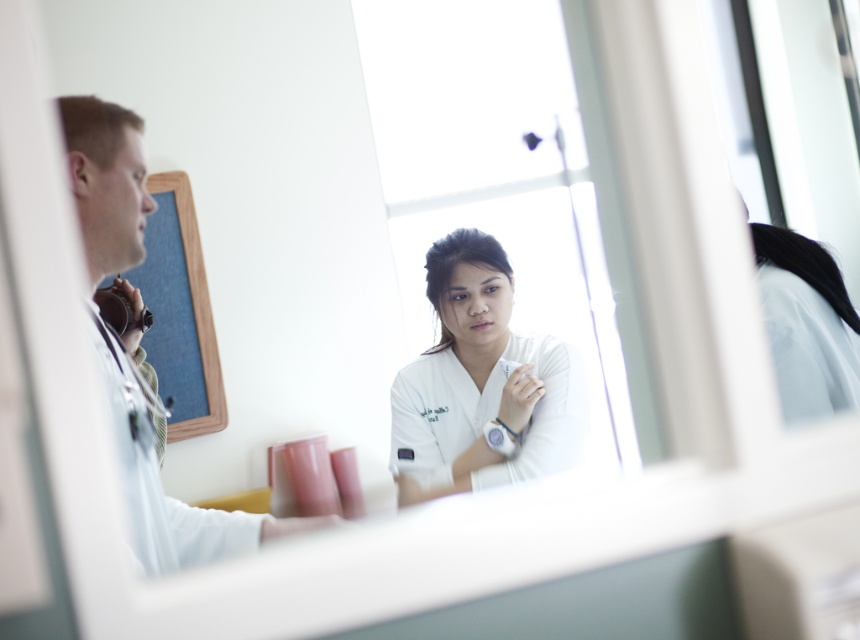
Does white smooth uniform at center have a greater height compared to white smooth stethoscope at left?

Incorrect, white smooth uniform at center's height is not larger of white smooth stethoscope at left's.

Which of these two, white smooth uniform at center or white smooth stethoscope at left, stands shorter?

Standing shorter between the two is white smooth uniform at center.

Image resolution: width=860 pixels, height=640 pixels. What do you see at coordinates (481, 385) in the screenshot? I see `white smooth uniform at center` at bounding box center [481, 385].

Identify the location of white smooth uniform at center. The height and width of the screenshot is (640, 860). [x=481, y=385].